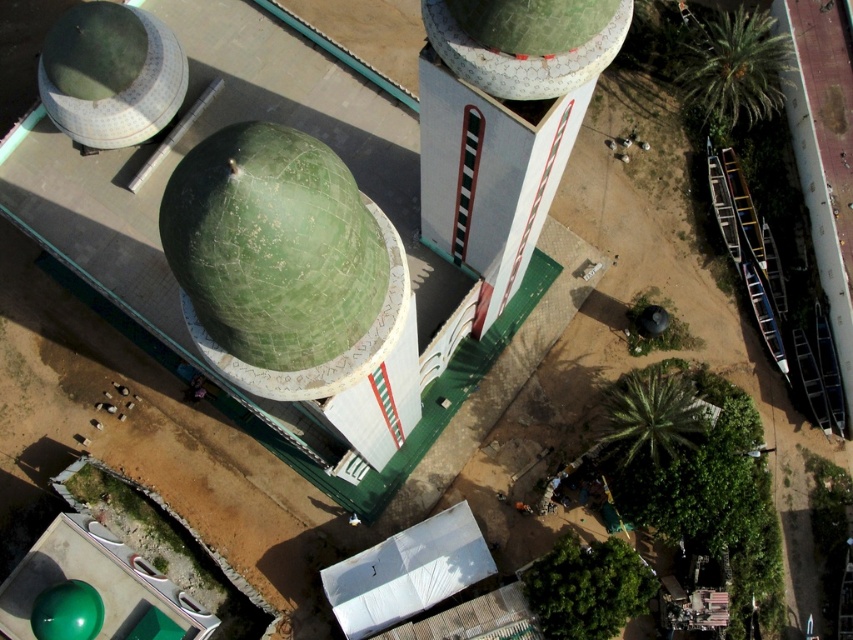
This screenshot has height=640, width=853. What do you see at coordinates (273, 244) in the screenshot?
I see `green matte dome at center` at bounding box center [273, 244].

Is point (196, 269) farther from viewer compared to point (624, 17)?

No, it is in front of (624, 17).

Find the location of a particular element. The width and height of the screenshot is (853, 640). green matte dome at center is located at coordinates (273, 244).

Which is more to the right, green matte dome at center or green concrete tower at upper center?

From the viewer's perspective, green concrete tower at upper center appears more on the right side.

Which is above, green matte dome at center or green concrete tower at upper center?

Positioned higher is green concrete tower at upper center.

I want to click on green matte dome at center, so click(273, 244).

This screenshot has height=640, width=853. In order to click on green matte dome at center in this screenshot , I will do `click(273, 244)`.

Between green concrete tower at upper center and green textured dome at upper center, which one appears on the left side from the viewer's perspective?

Positioned to the left is green concrete tower at upper center.

Does green concrete tower at upper center appear on the left side of green textured dome at upper center?

Correct, you'll find green concrete tower at upper center to the left of green textured dome at upper center.

Which is behind, point (556, 150) or point (524, 97)?

Point (556, 150)

The height and width of the screenshot is (640, 853). I want to click on green concrete tower at upper center, so click(503, 128).